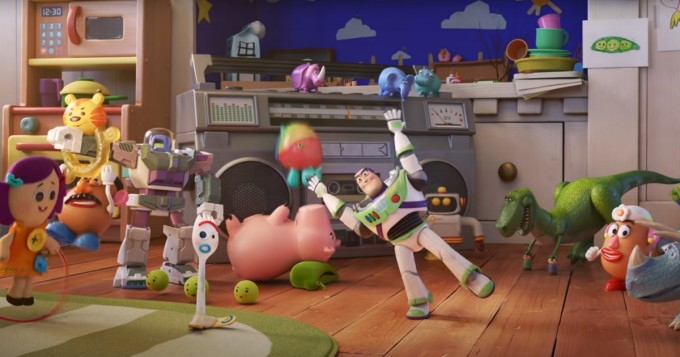
This screenshot has width=680, height=357. What are the coordinates of `green and white carpet` in the screenshot? It's located at (143, 342).